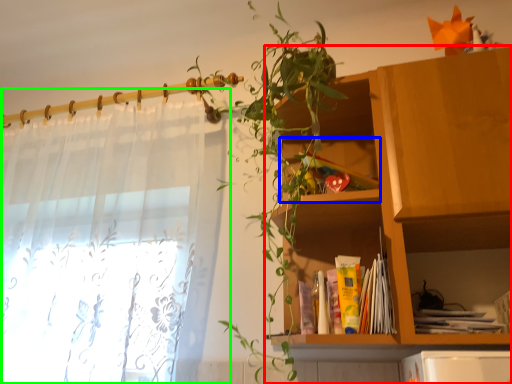
Question: Which is farther away from shelf (highlighted by a red box)? cabinet (highlighted by a blue box) or curtain (highlighted by a green box)?

Choices:
 (A) cabinet
 (B) curtain

Answer: (B)